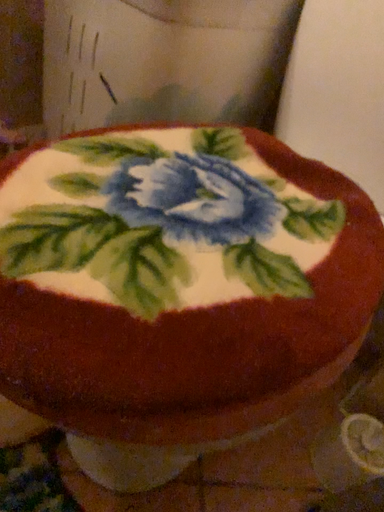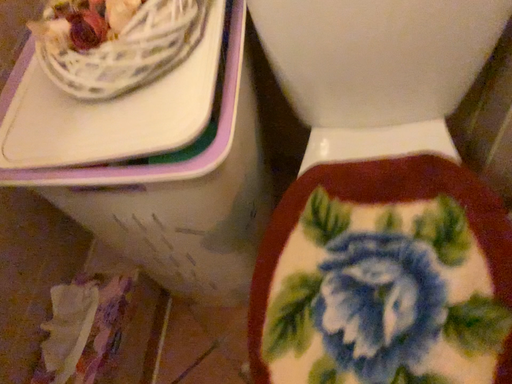
Question: How did the camera likely rotate when shooting the video?

Choices:
 (A) rotated left
 (B) rotated right

Answer: (B)